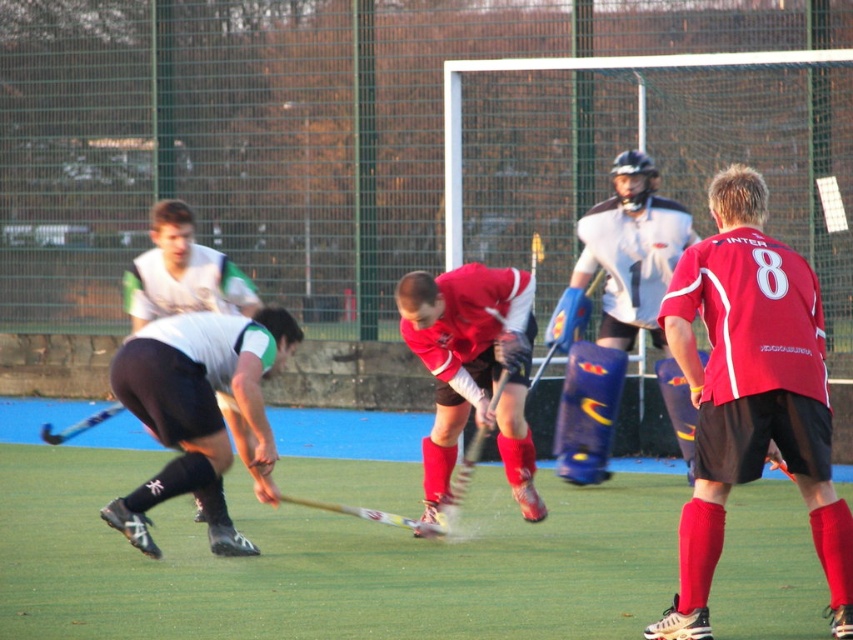
You are a spectator at the field hockey match. You notice the matte white jersey at center and the blue metallic hockey stick at lower left. Which object would appear bigger to you from your current viewpoint?

The matte white jersey at center appears larger than the blue metallic hockey stick at lower left because it has a larger size.

You are a referee observing a field hockey match. You notice the green artificial turf at center and the matte white jersey at center. Which object is positioned lower in the image?

The green artificial turf at center is positioned lower than the matte white jersey at center in the image.

You are a field hockey referee observing the match. You notice the green artificial turf at center and the matte white jersey at center. Which object is located more to the left?

The green artificial turf at center is positioned on the left side of matte white jersey at center, so it is more to the left.